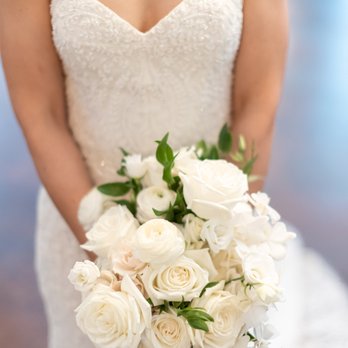
Identify the location of chest. (140, 9).